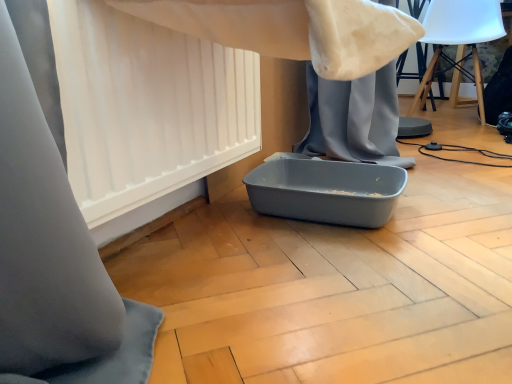
Question: Is white matte curtain at lower left wider than white plastic swivel chair at upper right?

Choices:
 (A) yes
 (B) no

Answer: (B)

Question: Is white matte curtain at lower left in front of white plastic swivel chair at upper right?

Choices:
 (A) no
 (B) yes

Answer: (B)

Question: Is white matte curtain at lower left smaller than white plastic swivel chair at upper right?

Choices:
 (A) no
 (B) yes

Answer: (B)

Question: Is white plastic swivel chair at upper right inside white matte curtain at lower left?

Choices:
 (A) yes
 (B) no

Answer: (B)

Question: Is white matte curtain at lower left at the right side of white plastic swivel chair at upper right?

Choices:
 (A) yes
 (B) no

Answer: (B)

Question: Is white matte curtain at lower left facing towards white plastic swivel chair at upper right?

Choices:
 (A) yes
 (B) no

Answer: (B)

Question: Is white matte curtain at lower left at the back of white plastic swivel chair at upper right?

Choices:
 (A) no
 (B) yes

Answer: (A)

Question: Considering the relative positions of white plastic swivel chair at upper right and white matte curtain at lower left in the image provided, is white plastic swivel chair at upper right in front of white matte curtain at lower left?

Choices:
 (A) yes
 (B) no

Answer: (B)

Question: Is white plastic swivel chair at upper right smaller than white matte curtain at lower left?

Choices:
 (A) yes
 (B) no

Answer: (B)

Question: Can you confirm if white plastic swivel chair at upper right is shorter than white matte curtain at lower left?

Choices:
 (A) yes
 (B) no

Answer: (B)

Question: Is there a large distance between white plastic swivel chair at upper right and white matte curtain at lower left?

Choices:
 (A) yes
 (B) no

Answer: (A)

Question: Is white plastic swivel chair at upper right outside white matte curtain at lower left?

Choices:
 (A) no
 (B) yes

Answer: (B)

Question: From a real-world perspective, is white plastic swivel chair at upper right above or below white matte curtain at lower left?

Choices:
 (A) below
 (B) above

Answer: (B)